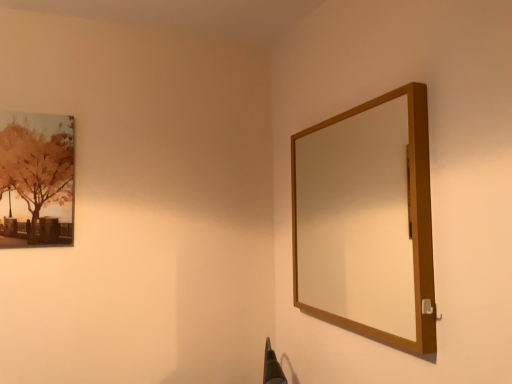
Where is `wooden mirror at upper right`? Image resolution: width=512 pixels, height=384 pixels. wooden mirror at upper right is located at coordinates (357, 219).

Measure the distance between wooden mirror at upper right and camera.

wooden mirror at upper right is 1.88 meters from camera.

Measure the distance between point (336, 287) and camera.

Point (336, 287) is 6.93 feet away from camera.

Describe the element at coordinates (357, 219) in the screenshot. The width and height of the screenshot is (512, 384). I see `wooden mirror at upper right` at that location.

Identify the location of wooden mirror at upper right. The height and width of the screenshot is (384, 512). (357, 219).